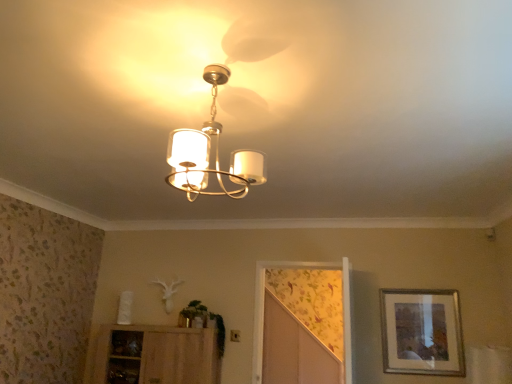
Question: Can you confirm if floral wallpaper screen door at center is wider than silver metallic picture frame at right?

Choices:
 (A) yes
 (B) no

Answer: (A)

Question: From a real-world perspective, is floral wallpaper screen door at center over silver metallic picture frame at right?

Choices:
 (A) yes
 (B) no

Answer: (A)

Question: Considering the relative positions of floral wallpaper screen door at center and silver metallic picture frame at right in the image provided, is floral wallpaper screen door at center to the right of silver metallic picture frame at right from the viewer's perspective?

Choices:
 (A) yes
 (B) no

Answer: (B)

Question: From a real-world perspective, is floral wallpaper screen door at center under silver metallic picture frame at right?

Choices:
 (A) yes
 (B) no

Answer: (B)

Question: Is floral wallpaper screen door at center smaller than silver metallic picture frame at right?

Choices:
 (A) no
 (B) yes

Answer: (A)

Question: Does floral wallpaper screen door at center have a lesser height compared to silver metallic picture frame at right?

Choices:
 (A) yes
 (B) no

Answer: (B)

Question: Considering the relative positions of silver metallic picture frame at right and wooden cabinet at lower left in the image provided, is silver metallic picture frame at right behind wooden cabinet at lower left?

Choices:
 (A) yes
 (B) no

Answer: (B)

Question: From a real-world perspective, is silver metallic picture frame at right under wooden cabinet at lower left?

Choices:
 (A) yes
 (B) no

Answer: (B)

Question: Does silver metallic picture frame at right have a greater width compared to wooden cabinet at lower left?

Choices:
 (A) no
 (B) yes

Answer: (A)

Question: Is silver metallic picture frame at right closer to the viewer compared to wooden cabinet at lower left?

Choices:
 (A) no
 (B) yes

Answer: (B)

Question: Is silver metallic picture frame at right at the right side of wooden cabinet at lower left?

Choices:
 (A) no
 (B) yes

Answer: (B)

Question: Is silver metallic picture frame at right facing towards wooden cabinet at lower left?

Choices:
 (A) no
 (B) yes

Answer: (A)

Question: Considering the relative positions of matte white chandelier at center and silver metallic picture frame at right in the image provided, is matte white chandelier at center to the left of silver metallic picture frame at right from the viewer's perspective?

Choices:
 (A) no
 (B) yes

Answer: (B)